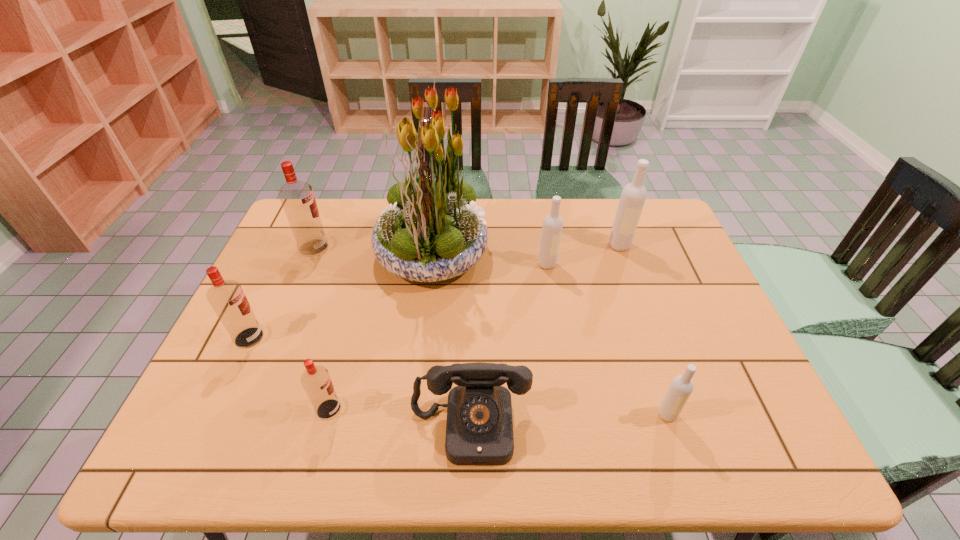
At what (x,y) coordinates should I click in order to perform the action: click on unoccupied position between the farthest white vodka and the rightmost red vodka. Please return your answer as a coordinate pair (x, y). Looking at the image, I should click on (474, 327).

Find the location of a particular element. The height and width of the screenshot is (540, 960). empty location between the telephone and the second nearest white vodka is located at coordinates (509, 346).

Locate an element on the screen. blank region between the second smallest red vodka and the telephone is located at coordinates (360, 382).

Locate an element on the screen. The width and height of the screenshot is (960, 540). vacant area between the nearest red vodka and the flower arrangement is located at coordinates (380, 331).

This screenshot has height=540, width=960. What are the coordinates of `vacant space in between the biggest white vodka and the flower arrangement` in the screenshot? It's located at 526,249.

You are a GUI agent. You are given a task and a screenshot of the screen. Output one action in this format:
    pyautogui.click(x=<x>, y=<y>)
    Task: Click on the object that stands as the seventh closest to the tallest object
    
    Given the screenshot: What is the action you would take?
    [681, 387]

Point out which object is positioned as the nearest to the farthest white vodka. Please provide its 2D coordinates. Your answer should be formatted as a tuple, i.e. [(x, y)], where the tuple contains the x and y coordinates of a point satisfying the conditions above.

[(552, 227)]

Identify which vodka is the fourth nearest to the flower arrangement. Please provide its 2D coordinates. Your answer should be formatted as a tuple, i.e. [(x, y)], where the tuple contains the x and y coordinates of a point satisfying the conditions above.

[(316, 381)]

Choose which vodka is the nearest neighbor to the farthest white vodka. Please provide its 2D coordinates. Your answer should be formatted as a tuple, i.e. [(x, y)], where the tuple contains the x and y coordinates of a point satisfying the conditions above.

[(552, 227)]

Select which red vodka appears as the third closest to the gray telephone. Please provide its 2D coordinates. Your answer should be formatted as a tuple, i.e. [(x, y)], where the tuple contains the x and y coordinates of a point satisfying the conditions above.

[(297, 198)]